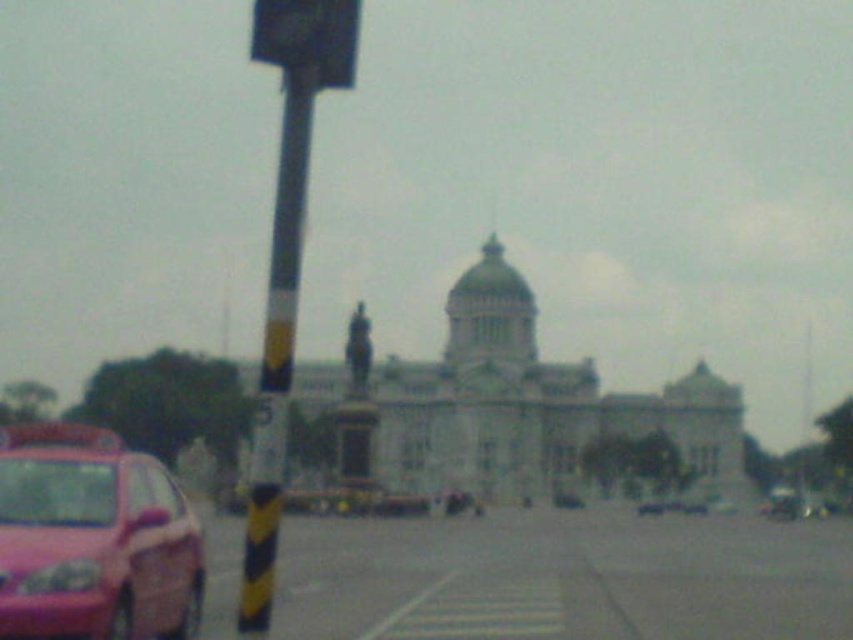
Question: Which of the following is the closest to the observer?

Choices:
 (A) dark gray plastic traffic light at upper center
 (B) yellow and black striped pole at left
 (C) pink glossy car at lower left

Answer: (A)

Question: Is the position of pink glossy car at lower left more distant than that of dark gray plastic traffic light at upper center?

Choices:
 (A) yes
 (B) no

Answer: (A)

Question: Which point is farther to the camera?

Choices:
 (A) pink matte car at lower left
 (B) dark gray plastic traffic light at upper center
 (C) yellow and black striped pole at left
 (D) pink glossy car at lower left

Answer: (A)

Question: Does pink glossy car at lower left appear on the right side of dark gray plastic traffic light at upper center?

Choices:
 (A) yes
 (B) no

Answer: (B)

Question: Estimate the real-world distances between objects in this image. Which object is closer to the yellow and black striped pole at left?

Choices:
 (A) pink glossy car at lower left
 (B) dark gray plastic traffic light at upper center

Answer: (A)

Question: Is pink glossy car at lower left to the left of yellow and black striped pole at left from the viewer's perspective?

Choices:
 (A) yes
 (B) no

Answer: (A)